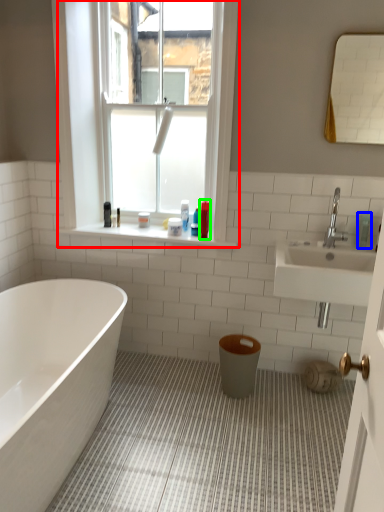
Question: Which object is the farthest from window (highlighted by a red box)? Choose among these: toiletry (highlighted by a blue box) or toiletry (highlighted by a green box).

Choices:
 (A) toiletry
 (B) toiletry

Answer: (A)